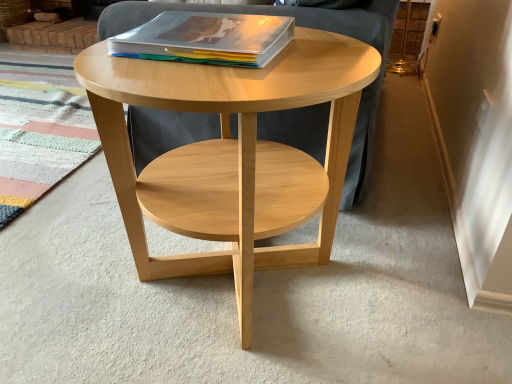
In order to click on vacant space underneath natural wood coffee table at center (from a real-world perspective) in this screenshot , I will do `click(229, 296)`.